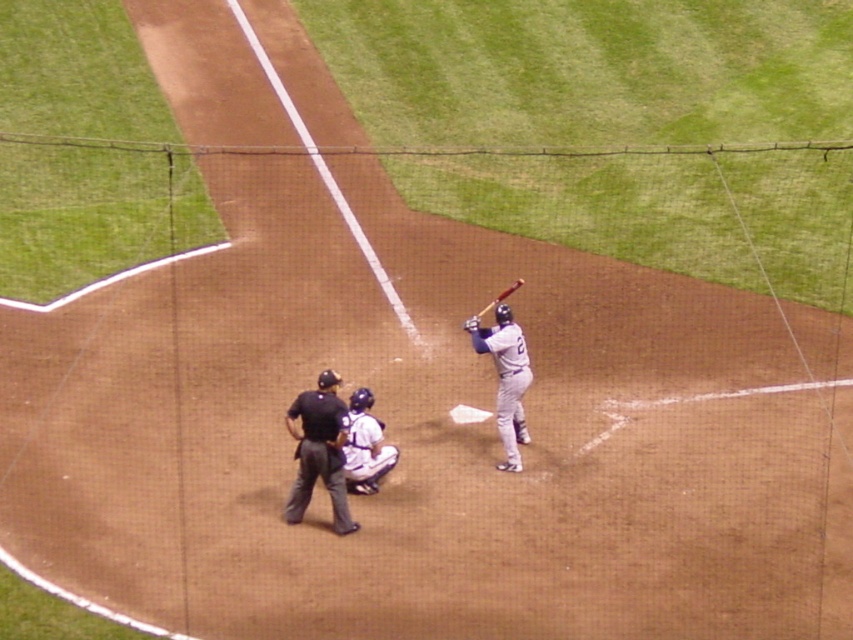
Question: Which of the following is the farthest from the observer?

Choices:
 (A) wooden baseball bat at center
 (B) white matte uniform at center
 (C) gray matte uniform at center

Answer: (A)

Question: Is black fabric umpire at center above wooden baseball bat at center?

Choices:
 (A) yes
 (B) no

Answer: (B)

Question: Which point appears farthest from the camera in this image?

Choices:
 (A) (366, 460)
 (B) (334, 428)
 (C) (486, 339)
 (D) (476, 324)

Answer: (D)

Question: Does black fabric umpire at center have a larger size compared to dark brown leather glove at center?

Choices:
 (A) yes
 (B) no

Answer: (A)

Question: Is black fabric umpire at center closer to camera compared to white matte uniform at center?

Choices:
 (A) yes
 (B) no

Answer: (A)

Question: Estimate the real-world distances between objects in this image. Which object is farther from the white matte uniform at center?

Choices:
 (A) gray matte uniform at center
 (B) wooden baseball bat at center

Answer: (B)